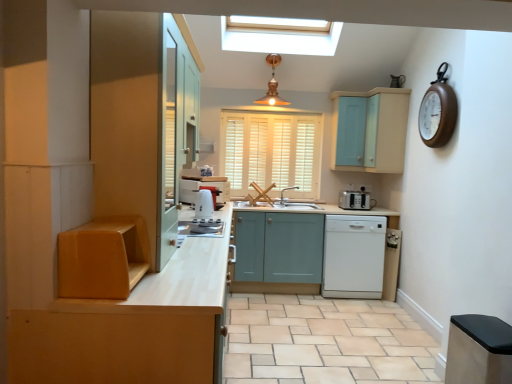
What are the coordinates of `vacant space to the right of matte yellow cabinet at left, the first cabinetry viewed from the left` in the screenshot? It's located at (176, 289).